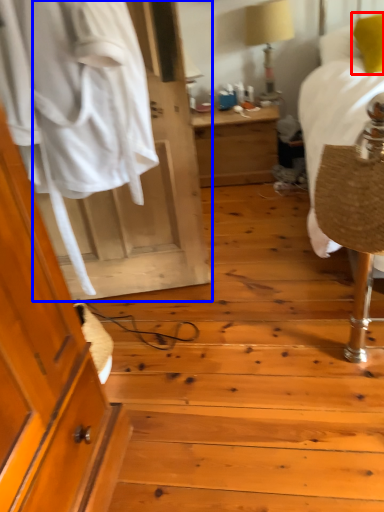
Question: Among these objects, which one is nearest to the camera, pillow (highlighted by a red box) or door (highlighted by a blue box)?

Choices:
 (A) pillow
 (B) door

Answer: (B)